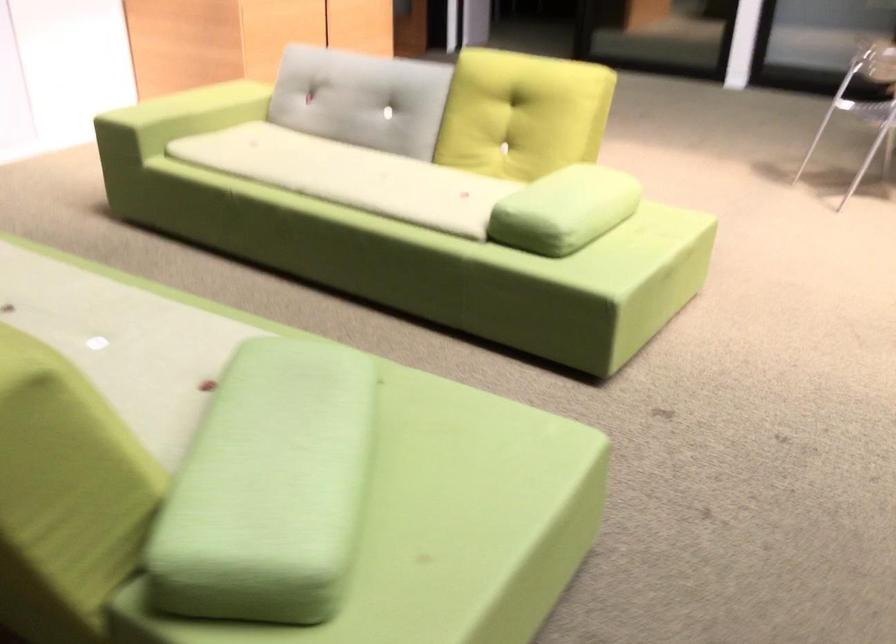
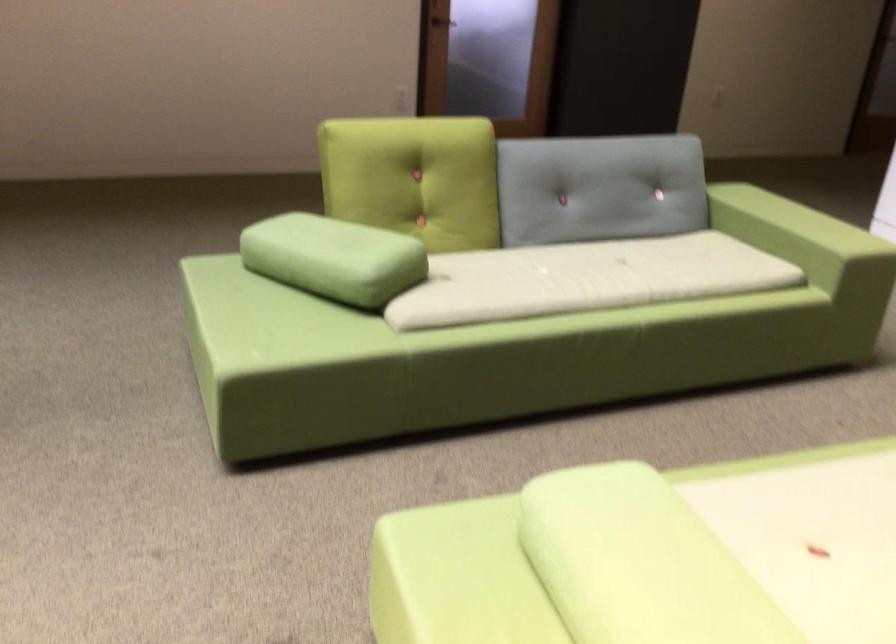
Locate, in the second image, the point that corresponds to [581,187] in the first image.

(639, 563)